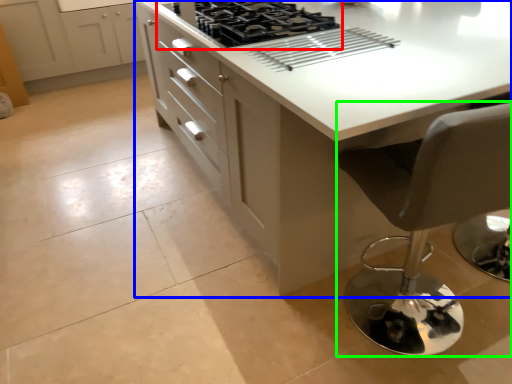
Question: Which object is the farthest from gas stove (highlighted by a red box)? Choose among these: countertop (highlighted by a blue box) or chair (highlighted by a green box).

Choices:
 (A) countertop
 (B) chair

Answer: (B)